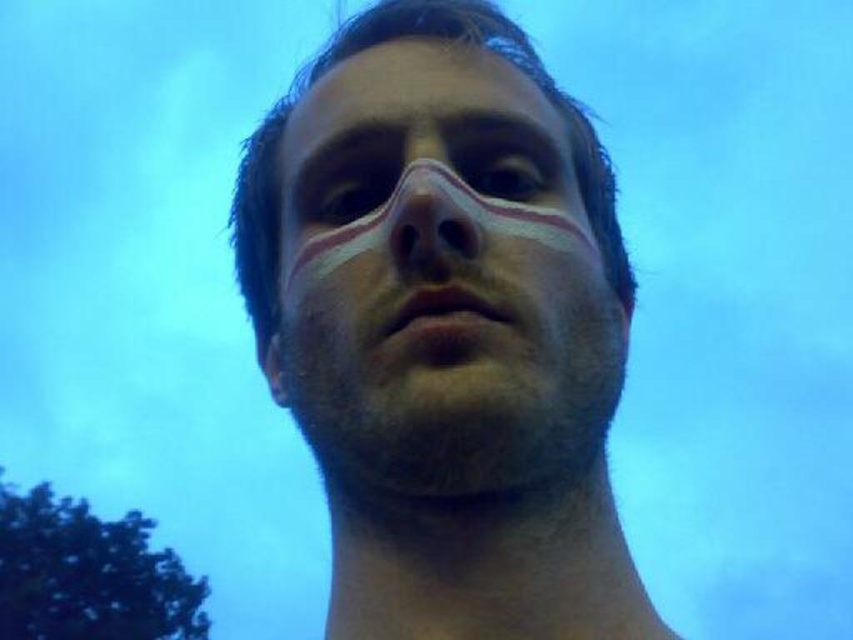
Who is positioned more to the left, white matte face at center or smooth skin eye at upper center?

Positioned to the left is white matte face at center.

Is white matte face at center to the right of smooth skin eye at upper center from the viewer's perspective?

In fact, white matte face at center is to the left of smooth skin eye at upper center.

This screenshot has width=853, height=640. What do you see at coordinates (437, 289) in the screenshot?
I see `white matte face at center` at bounding box center [437, 289].

What are the coordinates of `white matte face at center` in the screenshot? It's located at (437, 289).

Measure the distance between point (337, 266) and camera.

Point (337, 266) and camera are 25.17 inches apart.

Is point (453, 451) behind point (334, 180)?

No.

Which is in front, point (555, 156) or point (335, 216)?

Point (335, 216) is in front.

This screenshot has height=640, width=853. I want to click on white matte face at center, so click(x=437, y=289).

Measure the distance between point (437, 134) and camera.

Point (437, 134) is 26.83 inches from camera.

Is point (398, 294) positioned behind point (500, 148)?

No, it is not.

The width and height of the screenshot is (853, 640). I want to click on white matte face at center, so tap(437, 289).